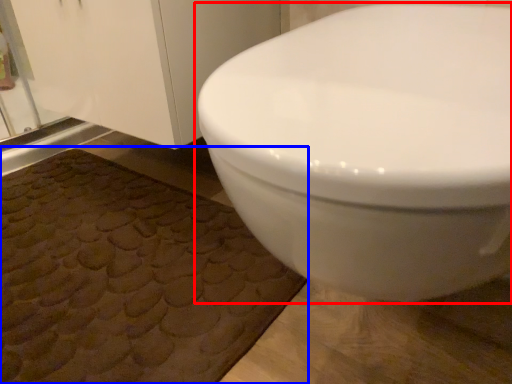
Question: Which object appears farthest to the camera in this image, toilet (highlighted by a red box) or bath mat (highlighted by a blue box)?

Choices:
 (A) toilet
 (B) bath mat

Answer: (B)